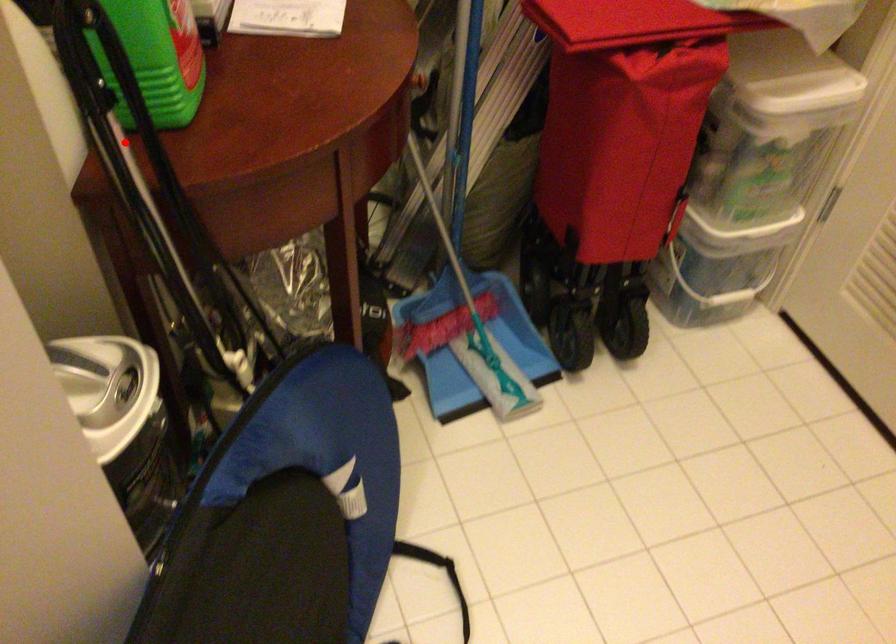
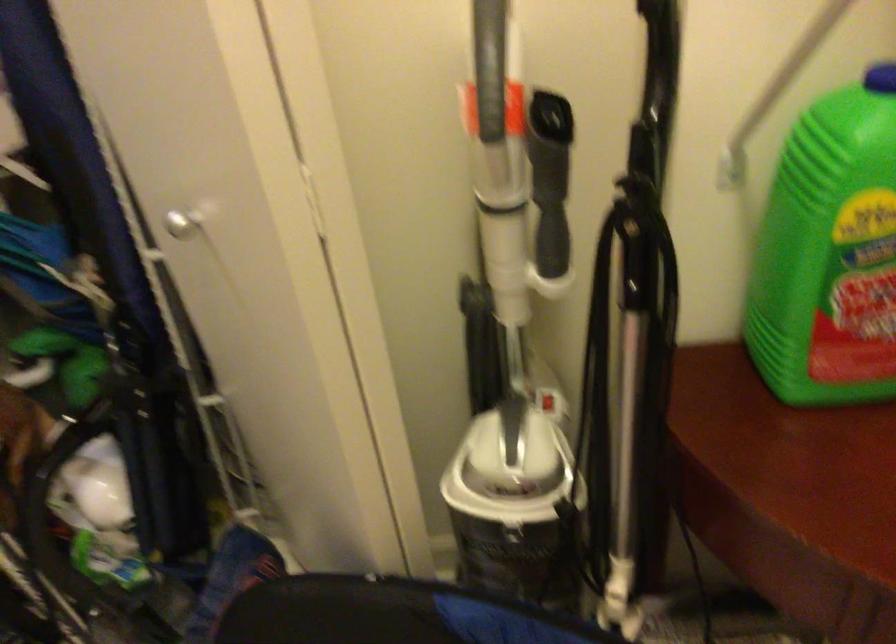
Locate, in the second image, the point that corresponds to the highlighted location in the first image.

(633, 348)